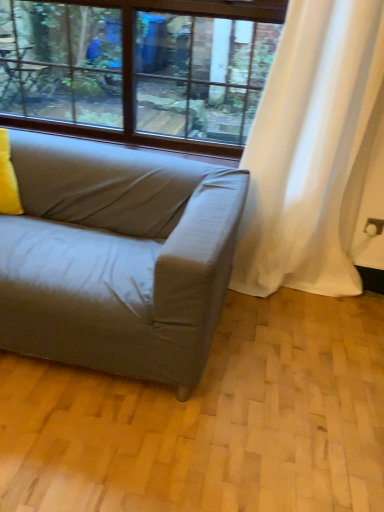
Image resolution: width=384 pixels, height=512 pixels. In order to click on matte gray couch at lower left in this screenshot , I will do `click(117, 257)`.

What is the approximate width of white sheer curtain at right?

It is 25.11 centimeters.

Locate an element on the screen. This screenshot has height=512, width=384. white sheer curtain at right is located at coordinates (311, 150).

Where is `matte gray couch at lower left`? This screenshot has width=384, height=512. matte gray couch at lower left is located at coordinates (117, 257).

Is yellow fabric pillow at left in front of white sheer curtain at right?

No, it is not.

From the image's perspective, between yellow fabric pillow at left and white sheer curtain at right, which one is located above?

From the image's view, white sheer curtain at right is above.

Which object is positioned more to the right, yellow fabric pillow at left or white sheer curtain at right?

From the viewer's perspective, white sheer curtain at right appears more on the right side.

Is yellow fabric pillow at left spatially inside white sheer curtain at right, or outside of it?

yellow fabric pillow at left lies outside white sheer curtain at right.

Based on the photo, is clear glass window at upper center smaller than white sheer curtain at right?

Yes.

Is clear glass window at upper center turned away from white sheer curtain at right?

No, white sheer curtain at right is not at the back of clear glass window at upper center.

From a real-world perspective, who is located higher, clear glass window at upper center or white sheer curtain at right?

clear glass window at upper center, from a real-world perspective.

Considering the positions of objects clear glass window at upper center and white sheer curtain at right in the image provided, who is in front, clear glass window at upper center or white sheer curtain at right?

white sheer curtain at right is closer to the camera.

Is yellow fabric pillow at left next to clear glass window at upper center?

yellow fabric pillow at left and clear glass window at upper center are clearly separated.

Does yellow fabric pillow at left contain clear glass window at upper center?

Definitely not — clear glass window at upper center is not inside yellow fabric pillow at left.

Identify the location of pillow below the clear glass window at upper center (from a real-world perspective). [8, 180].

From the image's perspective, is yellow fabric pillow at left on top of clear glass window at upper center?

Incorrect, from the image's perspective, yellow fabric pillow at left is lower than clear glass window at upper center.

In the image, is clear glass window at upper center positioned in front of or behind matte gray couch at lower left?

In the image, clear glass window at upper center appears behind matte gray couch at lower left.

From a real-world perspective, is clear glass window at upper center above or below matte gray couch at lower left?

Clearly, from a real-world perspective, clear glass window at upper center is above matte gray couch at lower left.

Could matte gray couch at lower left be considered to be inside clear glass window at upper center?

No, matte gray couch at lower left is not surrounded by clear glass window at upper center.

Considering the positions of objects clear glass window at upper center and matte gray couch at lower left in the image provided, who is more to the right, clear glass window at upper center or matte gray couch at lower left?

From the viewer's perspective, clear glass window at upper center appears more on the right side.

Measure the distance between matte gray couch at lower left and clear glass window at upper center.

75.41 centimeters.

Considering the positions of objects matte gray couch at lower left and clear glass window at upper center in the image provided, who is more to the right, matte gray couch at lower left or clear glass window at upper center?

Positioned to the right is clear glass window at upper center.

In the scene shown: How many degrees apart are the facing directions of matte gray couch at lower left and clear glass window at upper center?

The angular difference between matte gray couch at lower left and clear glass window at upper center is 1.96 degrees.

Would you say matte gray couch at lower left is a long distance from clear glass window at upper center?

That's not correct — matte gray couch at lower left is a little close to clear glass window at upper center.

Is matte gray couch at lower left surrounded by white sheer curtain at right?

That's incorrect, matte gray couch at lower left is not inside white sheer curtain at right.

From a real-world perspective, is white sheer curtain at right physically located above or below matte gray couch at lower left?

Clearly, from a real-world perspective, white sheer curtain at right is above matte gray couch at lower left.

Is point (299, 185) positioned before point (208, 164)?

No, it is not.

Is white sheer curtain at right touching matte gray couch at lower left?

No, white sheer curtain at right is not touching matte gray couch at lower left.

Between clear glass window at upper center and yellow fabric pillow at left, which one has more height?

Standing taller between the two is clear glass window at upper center.

Is clear glass window at upper center positioned beyond the bounds of yellow fabric pillow at left?

Yes, clear glass window at upper center is outside of yellow fabric pillow at left.

Is clear glass window at upper center in front of or behind yellow fabric pillow at left in the image?

Clearly, clear glass window at upper center is behind yellow fabric pillow at left.

From the image's perspective, between clear glass window at upper center and yellow fabric pillow at left, which one is located above?

clear glass window at upper center is shown above in the image.

The height and width of the screenshot is (512, 384). What are the coordinates of `curtain above the yellow fabric pillow at left (from the image's perspective)` in the screenshot? It's located at (311, 150).

This screenshot has width=384, height=512. What are the coordinates of `curtain to the right of clear glass window at upper center` in the screenshot? It's located at (311, 150).

Looking at the image, which one is located closer to yellow fabric pillow at left, white sheer curtain at right or clear glass window at upper center?

clear glass window at upper center lies closer to yellow fabric pillow at left than the other object.

From the image, which object appears to be farther from matte gray couch at lower left, clear glass window at upper center or white sheer curtain at right?

clear glass window at upper center lies further to matte gray couch at lower left than the other object.

Considering their positions, is matte gray couch at lower left positioned further to clear glass window at upper center than yellow fabric pillow at left?

Based on the image, yellow fabric pillow at left appears to be further to clear glass window at upper center.

Estimate the real-world distances between objects in this image. Which object is further from yellow fabric pillow at left, matte gray couch at lower left or clear glass window at upper center?

Based on the image, clear glass window at upper center appears to be further to yellow fabric pillow at left.

Looking at the image, which one is located closer to white sheer curtain at right, yellow fabric pillow at left or clear glass window at upper center?

Based on the image, clear glass window at upper center appears to be nearer to white sheer curtain at right.

Looking at the image, which one is located closer to clear glass window at upper center, white sheer curtain at right or matte gray couch at lower left?

Among the two, white sheer curtain at right is located nearer to clear glass window at upper center.

Looking at the image, which one is located closer to clear glass window at upper center, yellow fabric pillow at left or matte gray couch at lower left?

matte gray couch at lower left is positioned closer to the anchor clear glass window at upper center.

When comparing their distances from white sheer curtain at right, does clear glass window at upper center or matte gray couch at lower left seem closer?

matte gray couch at lower left.

Locate an element on the screen. This screenshot has width=384, height=512. studio couch between yellow fabric pillow at left and white sheer curtain at right is located at coordinates (117, 257).

Locate an element on the screen. window between yellow fabric pillow at left and white sheer curtain at right from left to right is located at coordinates (139, 69).

Find the location of a particular element. Image resolution: width=384 pixels, height=512 pixels. window between matte gray couch at lower left and white sheer curtain at right from left to right is located at coordinates (139, 69).

Find the location of a particular element. pillow between clear glass window at upper center and matte gray couch at lower left in the vertical direction is located at coordinates (8, 180).